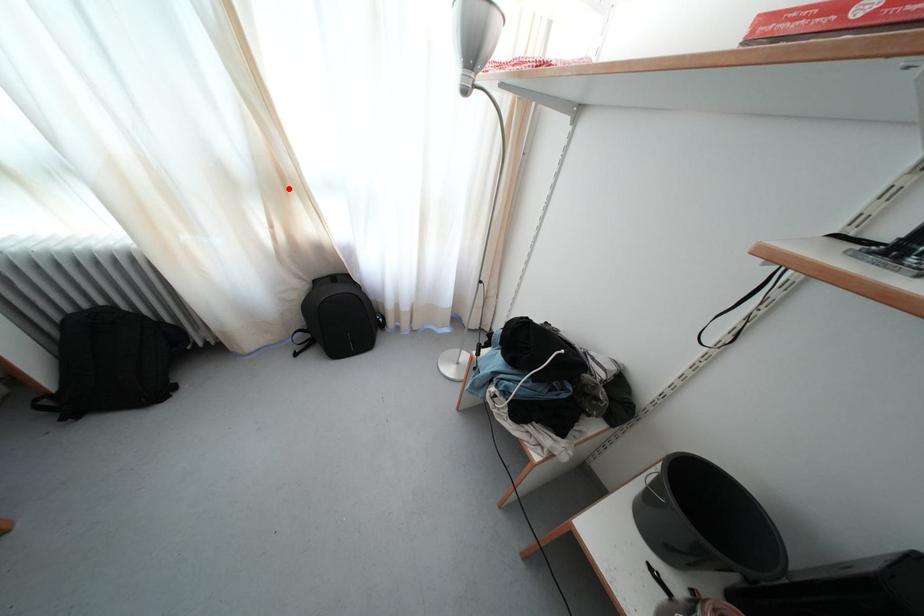
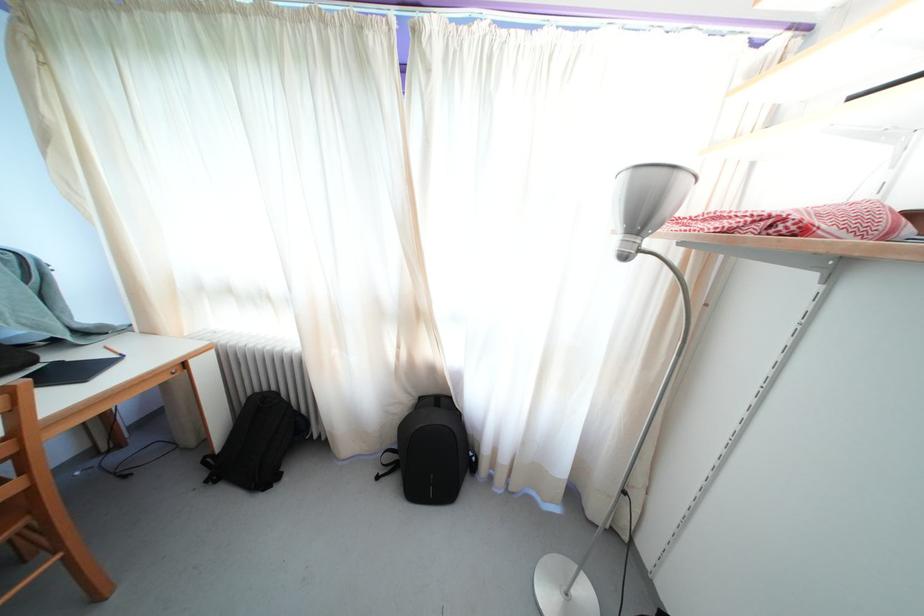
Question: I am providing you with two images of the same scene from different viewpoints. Image1 has a red point marked. In image2, the corresponding 3D location appears at what relative position? Reply with the corresponding letter.

Choices:
 (A) Closer
 (B) Farther

Answer: (B)